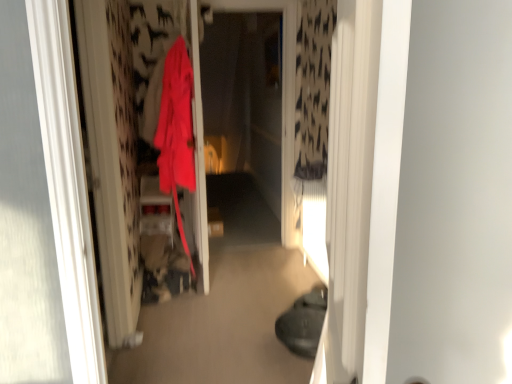
The width and height of the screenshot is (512, 384). Describe the element at coordinates (176, 131) in the screenshot. I see `matte red coat at center` at that location.

The image size is (512, 384). Identify the location of matte red coat at center. (176, 131).

Measure the distance between point (185, 131) and camera.

Point (185, 131) and camera are 9.65 feet apart.

Identify the location of transparent plastic screen door at center. (244, 99).

Describe the element at coordinates (244, 99) in the screenshot. I see `transparent plastic screen door at center` at that location.

Find the location of a particular element. The width and height of the screenshot is (512, 384). matte red coat at center is located at coordinates (176, 131).

Considering the positions of objects matte red coat at center and transparent plastic screen door at center in the image provided, who is more to the right, matte red coat at center or transparent plastic screen door at center?

transparent plastic screen door at center is more to the right.

Considering their positions, is matte red coat at center located in front of or behind transparent plastic screen door at center?

Visually, matte red coat at center is located in front of transparent plastic screen door at center.

Considering the positions of points (176, 138) and (250, 27), is point (176, 138) farther from camera compared to point (250, 27)?

No, it is not.

From the image's perspective, who appears lower, matte red coat at center or transparent plastic screen door at center?

matte red coat at center appears lower in the image.

From a real-world perspective, relative to transparent plastic screen door at center, is matte red coat at center vertically above or below?

Clearly, from a real-world perspective, matte red coat at center is below transparent plastic screen door at center.

Considering the sizes of objects matte red coat at center and transparent plastic screen door at center in the image provided, who is thinner, matte red coat at center or transparent plastic screen door at center?

Thinner between the two is transparent plastic screen door at center.

From their relative heights in the image, would you say matte red coat at center is taller or shorter than transparent plastic screen door at center?

matte red coat at center is shorter than transparent plastic screen door at center.

Who is bigger, matte red coat at center or transparent plastic screen door at center?

With larger size is matte red coat at center.

Does matte red coat at center contain transparent plastic screen door at center?

Actually, transparent plastic screen door at center is outside matte red coat at center.

Can you see matte red coat at center touching transparent plastic screen door at center?

They are not placed beside each other.

Is matte red coat at center aimed at transparent plastic screen door at center?

Yes, matte red coat at center is oriented towards transparent plastic screen door at center.

How much distance is there between matte red coat at center and transparent plastic screen door at center?

matte red coat at center and transparent plastic screen door at center are 2.38 meters apart from each other.

Identify the location of cloak that appears below the transparent plastic screen door at center (from a real-world perspective). (176, 131).

Considering the relative positions of transparent plastic screen door at center and matte red coat at center in the image provided, is transparent plastic screen door at center to the left of matte red coat at center from the viewer's perspective?

In fact, transparent plastic screen door at center is to the right of matte red coat at center.

Does transparent plastic screen door at center lie in front of matte red coat at center?

No, transparent plastic screen door at center is behind matte red coat at center.

Is point (260, 103) farther from viewer compared to point (180, 118)?

That is True.

From the image's perspective, is transparent plastic screen door at center under matte red coat at center?

No.

From a real-world perspective, is transparent plastic screen door at center physically below matte red coat at center?

No.

Which of these two, transparent plastic screen door at center or matte red coat at center, is thinner?

Thinner between the two is transparent plastic screen door at center.

Which of these two, transparent plastic screen door at center or matte red coat at center, stands taller?

Standing taller between the two is transparent plastic screen door at center.

Based on their sizes in the image, would you say transparent plastic screen door at center is bigger or smaller than matte red coat at center?

Considering their sizes, transparent plastic screen door at center takes up less space than matte red coat at center.

Can matte red coat at center be found inside transparent plastic screen door at center?

Actually, matte red coat at center is outside transparent plastic screen door at center.

Can you see transparent plastic screen door at center touching matte red coat at center?

They are not placed beside each other.

Is transparent plastic screen door at center facing towards matte red coat at center?

No.

Measure the distance between transparent plastic screen door at center and matte red coat at center.

They are 2.38 meters apart.

Find the location of a particular element. The image size is (512, 384). screen door to the right of matte red coat at center is located at coordinates (244, 99).

This screenshot has height=384, width=512. I want to click on cloak located on the left of transparent plastic screen door at center, so click(176, 131).

Identify the location of cloak in front of the transparent plastic screen door at center. (176, 131).